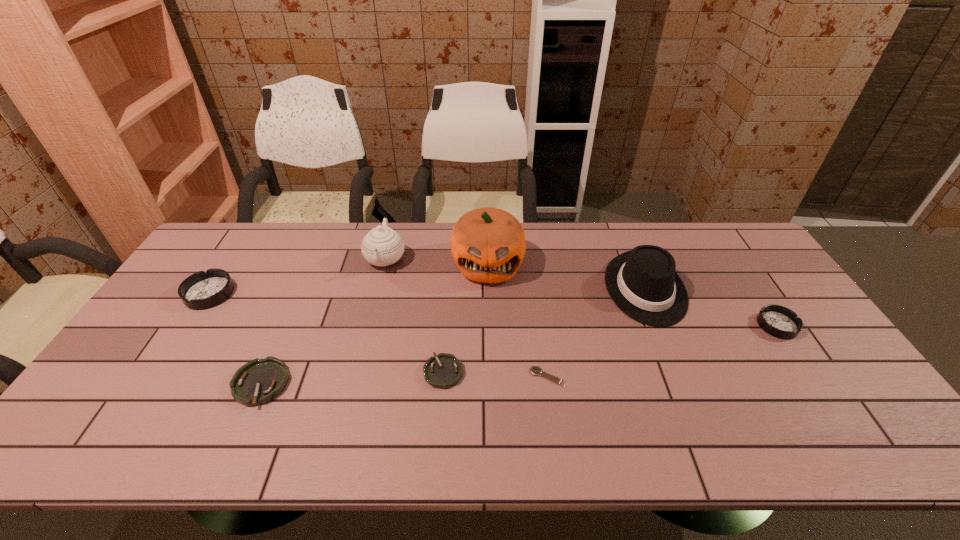
In order to click on object that ranks as the second closest to the smaller dark ashtray in this screenshot , I will do `click(535, 370)`.

Point out which ashtray is positioned as the third nearest to the third tallest ashtray. Please provide its 2D coordinates. Your answer should be formatted as a tuple, i.e. [(x, y)], where the tuple contains the x and y coordinates of a point satisfying the conditions above.

[(778, 321)]

Point out which ashtray is positioned as the fourth nearest to the pumpkin. Please provide its 2D coordinates. Your answer should be formatted as a tuple, i.e. [(x, y)], where the tuple contains the x and y coordinates of a point satisfying the conditions above.

[(202, 290)]

What are the coordinates of `vacant region that satisfies the following two spatial constraints: 1. on the face of the rightmost ashtray; 2. on the right side of the tallest object` in the screenshot? It's located at (489, 325).